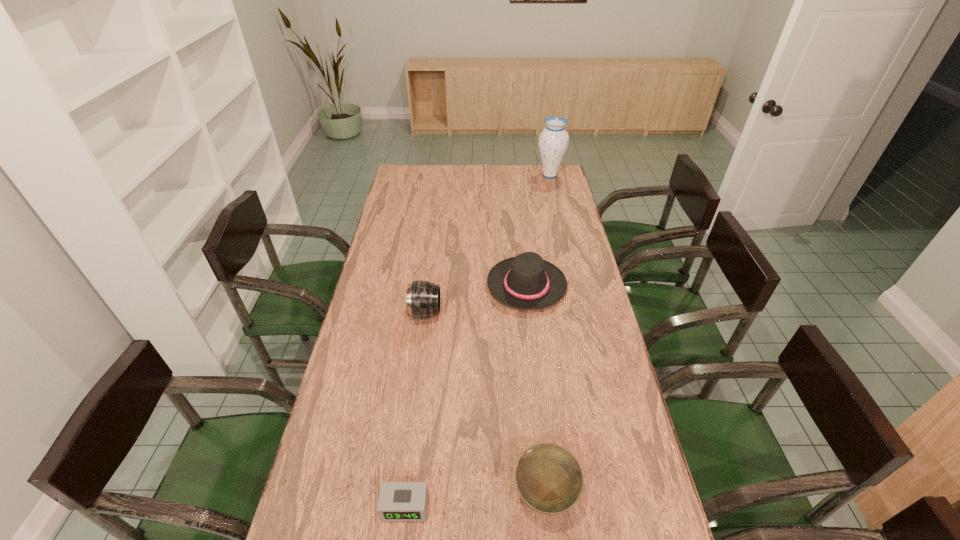
Locate an element on the screen. This screenshot has height=540, width=960. vacant area that satisfies the following two spatial constraints: 1. on the back side of the bowl; 2. at the front element of the fourth shortest object is located at coordinates (526, 314).

I want to click on blank space that satisfies the following two spatial constraints: 1. on the front side of the vase; 2. at the front element of the fourth shortest object, so click(582, 314).